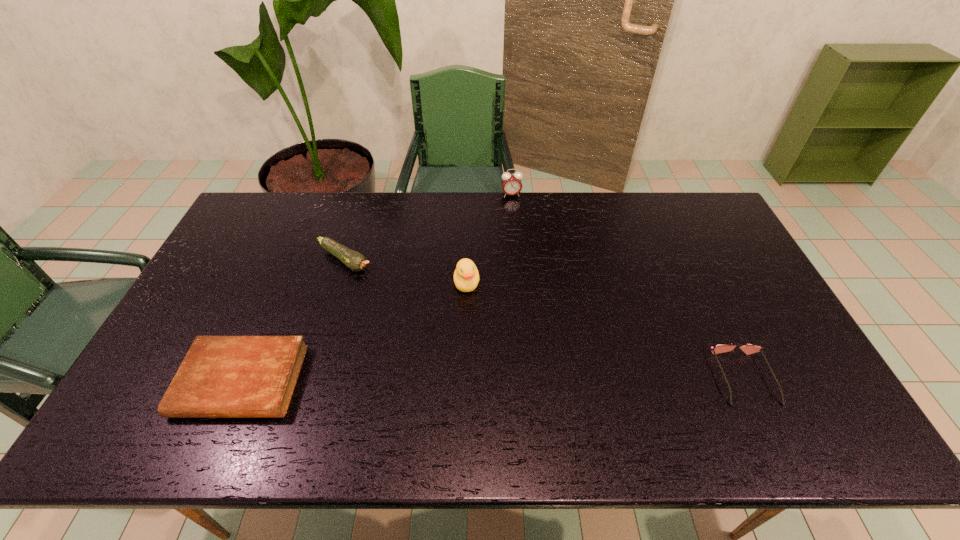
This screenshot has height=540, width=960. I want to click on free region located on the face of the third object from left to right, so click(467, 356).

Image resolution: width=960 pixels, height=540 pixels. In order to click on vacant space situated on the face of the third object from left to right in this screenshot , I will do `click(467, 332)`.

Where is `free location located 0.160m at the blossom end of the zucchini`? The image size is (960, 540). free location located 0.160m at the blossom end of the zucchini is located at coordinates (399, 295).

This screenshot has width=960, height=540. I want to click on blank area located at the blossom end of the zucchini, so click(411, 304).

You are a GUI agent. You are given a task and a screenshot of the screen. Output one action in this format:
    pyautogui.click(x=<x>, y=<y>)
    Task: Click on the free space located 0.160m at the blossom end of the zucchini
    The width and height of the screenshot is (960, 540).
    Given the screenshot: What is the action you would take?
    pyautogui.click(x=399, y=295)

Identify the location of object situated at the far edge. [x=511, y=182].

At what (x,y) coordinates should I click in order to perform the action: click on Bible at the near edge. Please return your answer as a coordinate pair (x, y). Looking at the image, I should click on (221, 376).

This screenshot has height=540, width=960. What are the coordinates of `sunglasses that is at the near edge` in the screenshot? It's located at (749, 348).

Identify the location of object that is at the left edge. The width and height of the screenshot is (960, 540). (221, 376).

This screenshot has height=540, width=960. What are the coordinates of `object present at the right edge` in the screenshot? It's located at (749, 348).